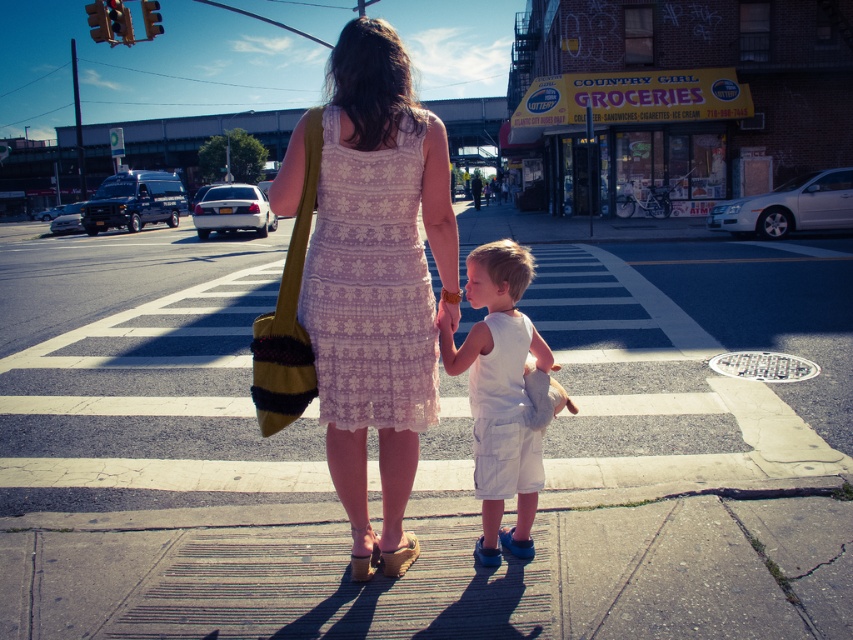
Who is more forward, (335, 410) or (360, 230)?

Positioned in front is point (360, 230).

Does point (440, 212) come closer to viewer compared to point (341, 310)?

That is False.

Locate an element on the screen. Image resolution: width=853 pixels, height=640 pixels. white lace dress at center is located at coordinates (376, 282).

Between point (809, 323) and point (361, 99), which one is positioned behind?

Point (809, 323)

Which is in front, point (1, 292) or point (430, 324)?

Point (430, 324)

This screenshot has height=640, width=853. I want to click on gray concrete sidewalk at center, so click(422, 452).

Which of these two, lace fabric dress at center or white cotton shorts at center, stands taller?

lace fabric dress at center

Between point (369, 164) and point (498, 380), which one is positioned behind?

The point (498, 380) is behind.

I want to click on lace fabric dress at center, so click(x=370, y=285).

The width and height of the screenshot is (853, 640). Identify the location of lace fabric dress at center. (370, 285).